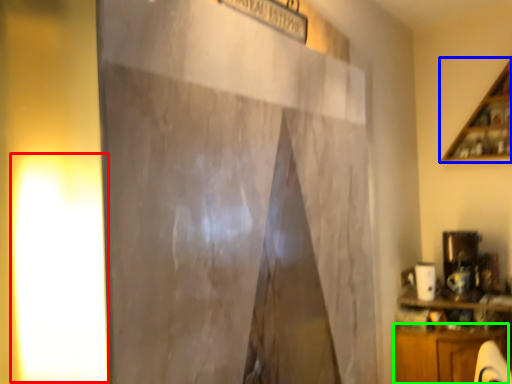
Question: Considering the real-world distances, which object is farthest from light (highlighted by a red box)? shelf (highlighted by a blue box) or cabinetry (highlighted by a green box)?

Choices:
 (A) shelf
 (B) cabinetry

Answer: (A)